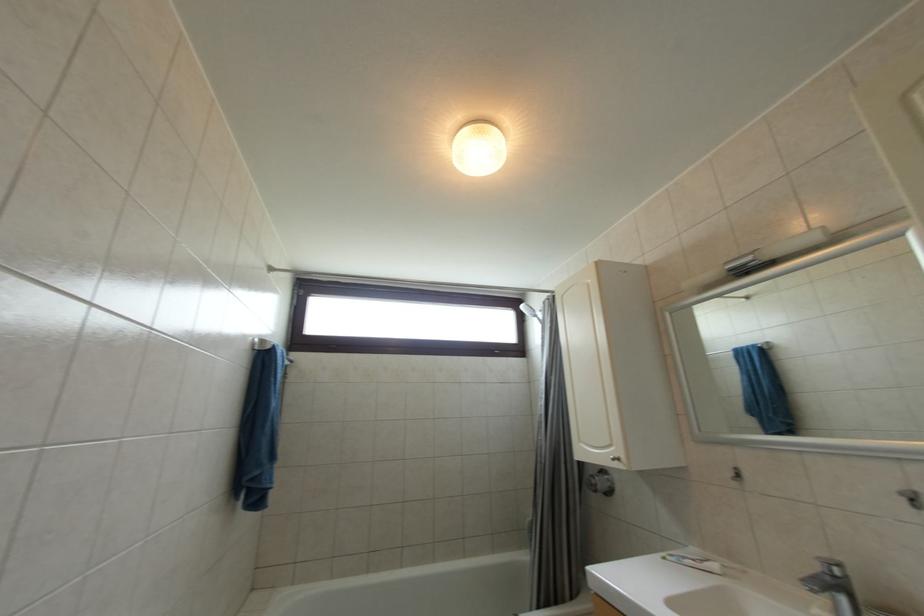
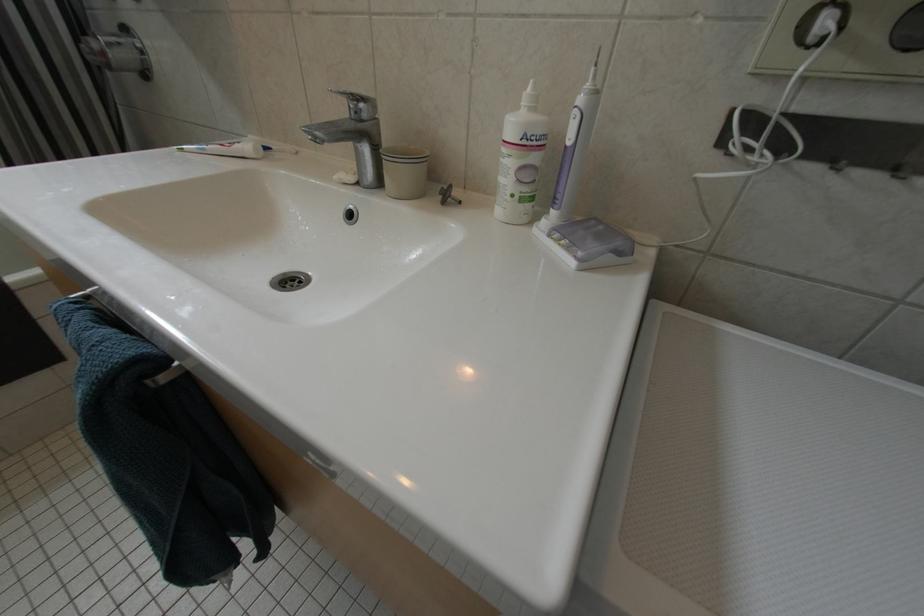
How did the camera likely rotate?

The rotation direction of the camera is right-down.